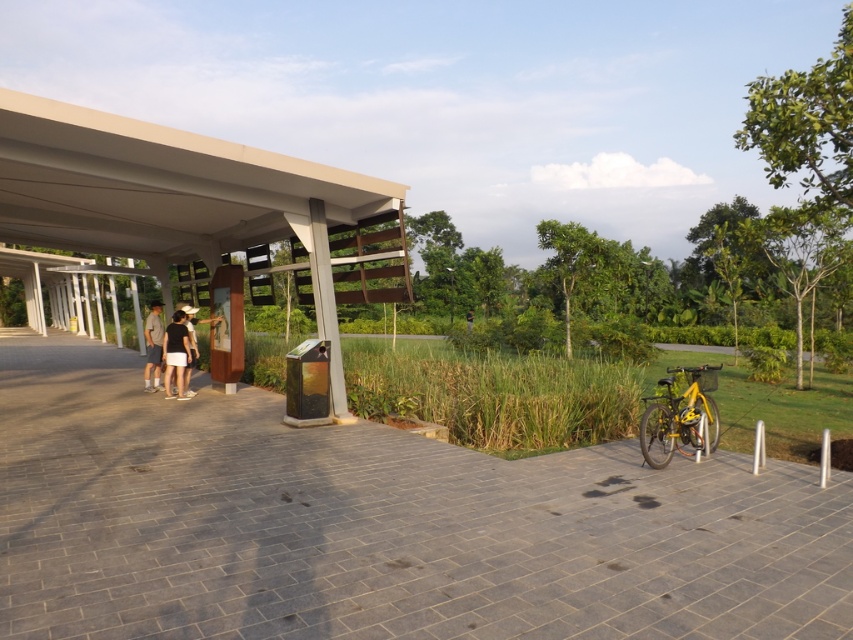
You are planning to place a small potted plant between the gray brick path at center and the yellow matte bicycle at lower right. Which object should the plant be closer to if it needs to be placed closer to the shorter object?

The gray brick path at center is shorter than the yellow matte bicycle at lower right, so the plant should be placed closer to the gray brick path at center.